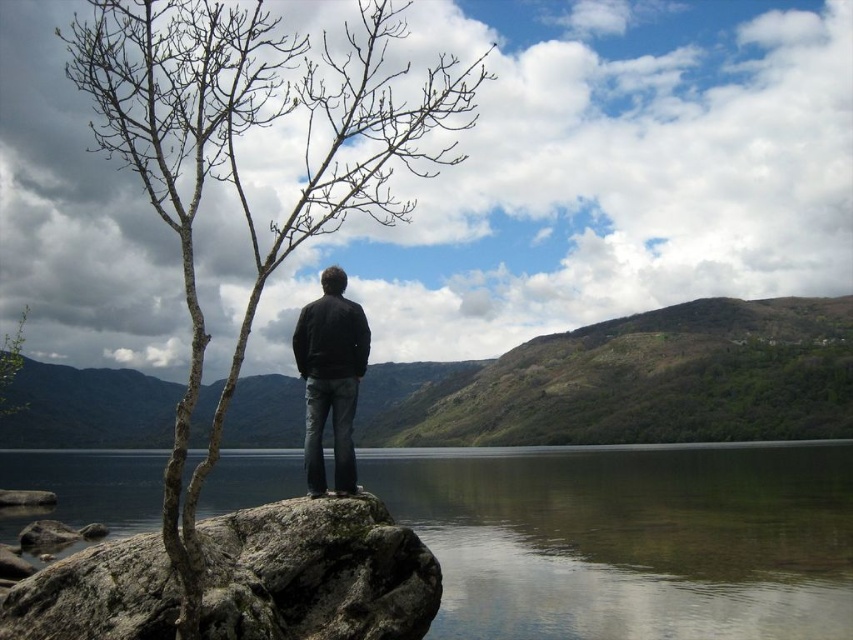
Question: Is transparent water at center thinner than black matte jacket at center?

Choices:
 (A) no
 (B) yes

Answer: (A)

Question: Is rough textured rock at lower left smaller than black matte jacket at center?

Choices:
 (A) yes
 (B) no

Answer: (A)

Question: Which object is farther from the camera taking this photo?

Choices:
 (A) black matte jacket at center
 (B) bare branches at left
 (C) rough textured rock at lower left
 (D) transparent water at center

Answer: (D)

Question: Which object is the farthest from the rough textured rock at lower left?

Choices:
 (A) black matte jacket at center
 (B) bare branches at left

Answer: (B)

Question: Which point is farther from the camera taking this photo?

Choices:
 (A) (515, 547)
 (B) (351, 401)
 (C) (137, 32)
 (D) (281, 621)

Answer: (A)

Question: Does bare branches at left appear on the right side of black matte jacket at center?

Choices:
 (A) no
 (B) yes

Answer: (A)